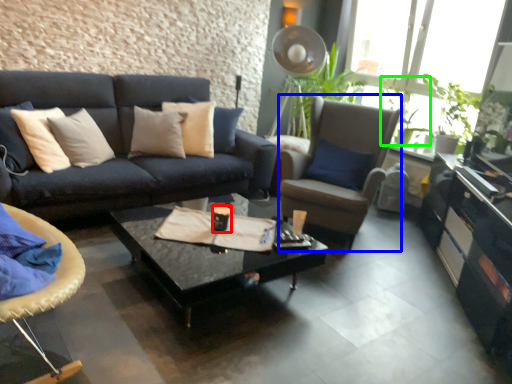
Question: Which object is positioned closest to coffee cup (highlighted by a red box)? Select from chair (highlighted by a blue box) and houseplant (highlighted by a green box).

Choices:
 (A) chair
 (B) houseplant

Answer: (A)